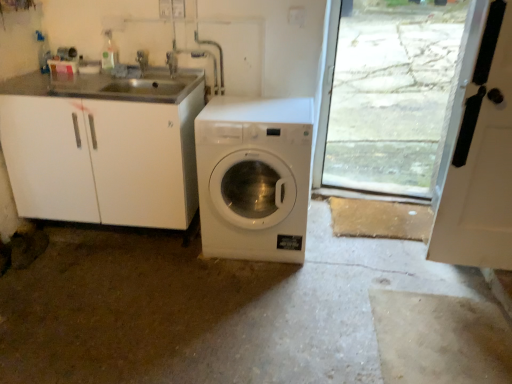
Question: Is brushed metal faucet at upper center, the second faucet in the right-to-left sequence, at the left side of brushed metal faucet at upper center, which is counted as the first faucet, starting from the right?

Choices:
 (A) no
 (B) yes

Answer: (B)

Question: Considering the relative sizes of brushed metal faucet at upper center, the first faucet from the left, and brushed metal faucet at upper center, which is counted as the second faucet, starting from the left, in the image provided, is brushed metal faucet at upper center, the first faucet from the left, bigger than brushed metal faucet at upper center, which is counted as the second faucet, starting from the left,?

Choices:
 (A) yes
 (B) no

Answer: (A)

Question: Is brushed metal faucet at upper center, the second faucet in the right-to-left sequence, not close to brushed metal faucet at upper center, which is counted as the second faucet, starting from the left?

Choices:
 (A) yes
 (B) no

Answer: (B)

Question: Considering the relative positions of brushed metal faucet at upper center, the second faucet in the right-to-left sequence, and brushed metal faucet at upper center, which is counted as the first faucet, starting from the right, in the image provided, is brushed metal faucet at upper center, the second faucet in the right-to-left sequence, behind brushed metal faucet at upper center, which is counted as the first faucet, starting from the right,?

Choices:
 (A) yes
 (B) no

Answer: (A)

Question: Is brushed metal faucet at upper center, the first faucet from the left, with brushed metal faucet at upper center, which is counted as the first faucet, starting from the right?

Choices:
 (A) no
 (B) yes

Answer: (A)

Question: Is brushed metal faucet at upper center, the second faucet in the right-to-left sequence, wider or thinner than white matte door at right?

Choices:
 (A) thin
 (B) wide

Answer: (A)

Question: Considering their positions, is brushed metal faucet at upper center, the second faucet in the right-to-left sequence, located in front of or behind white matte door at right?

Choices:
 (A) front
 (B) behind

Answer: (B)

Question: Considering the positions of point 138,59 and point 503,34, is point 138,59 closer or farther from the camera than point 503,34?

Choices:
 (A) closer
 (B) farther

Answer: (B)

Question: Based on their positions, is brushed metal faucet at upper center, the second faucet in the right-to-left sequence, located to the left or right of white matte door at right?

Choices:
 (A) right
 (B) left

Answer: (B)

Question: Considering the positions of white glossy washing machine at center and brushed metal faucet at upper center, the first faucet from the left, in the image, is white glossy washing machine at center bigger or smaller than brushed metal faucet at upper center, the first faucet from the left,?

Choices:
 (A) small
 (B) big

Answer: (B)

Question: Relative to brushed metal faucet at upper center, the first faucet from the left, is white glossy washing machine at center in front or behind?

Choices:
 (A) front
 (B) behind

Answer: (A)

Question: Is white glossy washing machine at center taller or shorter than brushed metal faucet at upper center, the first faucet from the left?

Choices:
 (A) short
 (B) tall

Answer: (B)

Question: From a real-world perspective, relative to brushed metal faucet at upper center, the first faucet from the left, is white glossy washing machine at center vertically above or below?

Choices:
 (A) below
 (B) above

Answer: (A)

Question: In terms of height, does white matte door at right look taller or shorter compared to white glossy washing machine at center?

Choices:
 (A) short
 (B) tall

Answer: (B)

Question: Considering their positions, is white matte door at right located in front of or behind white glossy washing machine at center?

Choices:
 (A) behind
 (B) front

Answer: (B)